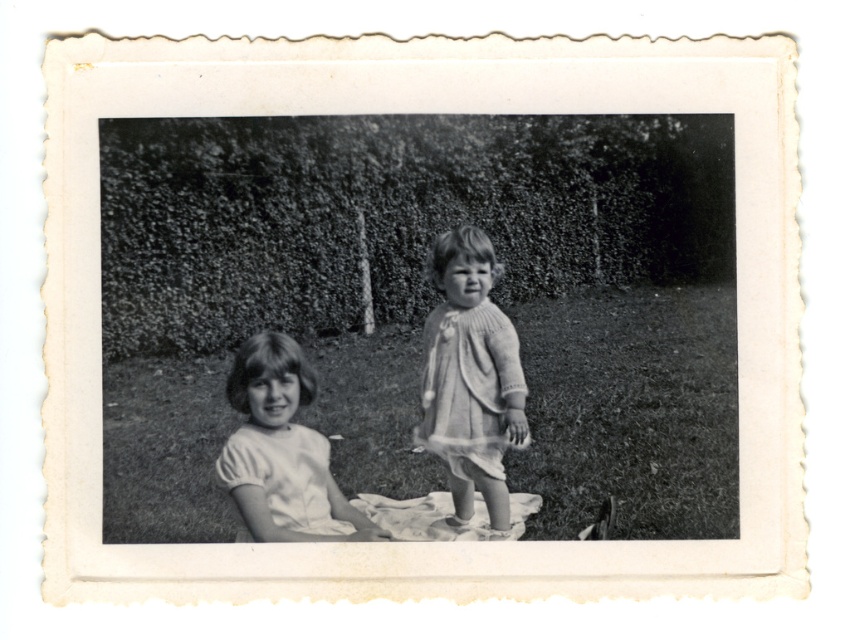
Which is in front, point (259, 524) or point (519, 387)?

Point (259, 524) is in front.

Does white cotton shirt at left have a smaller size compared to knitted white dress at center?

Incorrect, white cotton shirt at left is not smaller in size than knitted white dress at center.

Does point (258, 362) lie in front of point (514, 374)?

That is True.

Find the location of `white cotton shirt at left`. white cotton shirt at left is located at coordinates (281, 451).

Which is above, grassy lawn at center or knitted white dress at center?

grassy lawn at center

Does point (153, 508) lie behind point (496, 440)?

No, it is in front of (496, 440).

The height and width of the screenshot is (640, 850). I want to click on grassy lawn at center, so click(630, 412).

Between point (559, 499) and point (231, 388), which one is positioned behind?

The point (559, 499) is more distant.

Is point (622, 324) closer to camera compared to point (323, 461)?

No, (622, 324) is further to viewer.

The image size is (850, 640). I want to click on grassy lawn at center, so click(630, 412).